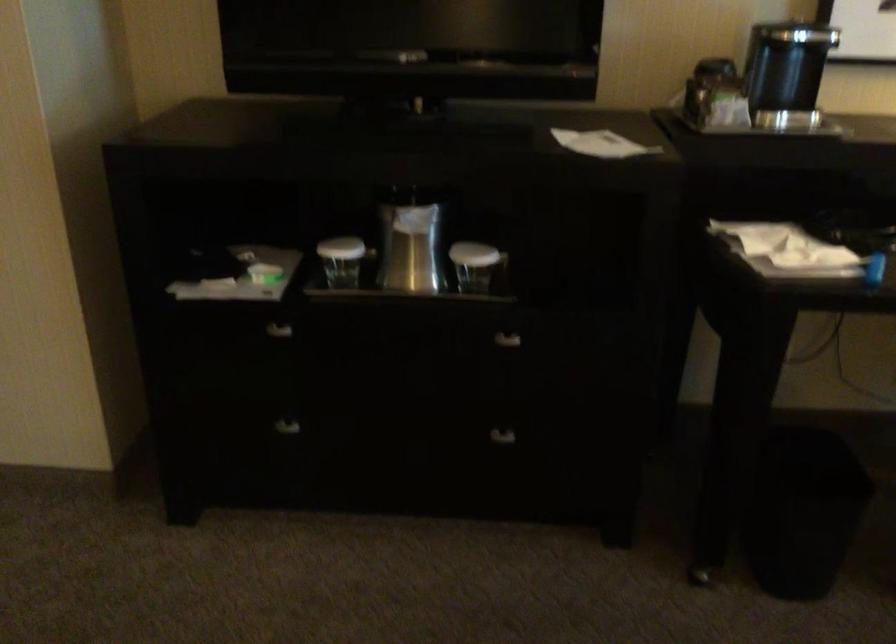
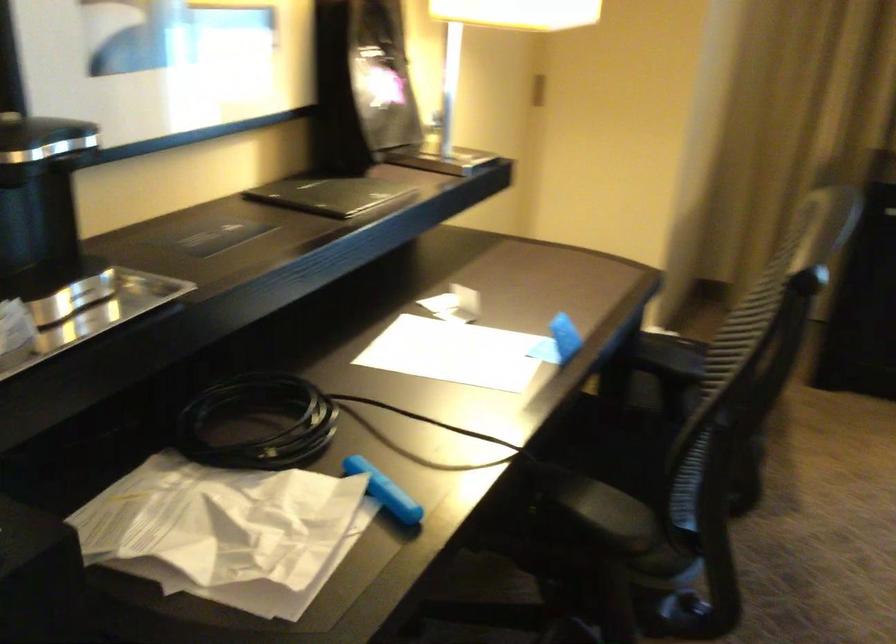
Find the pixel in the second image that matches the point at 791,134 in the first image.

(90, 310)